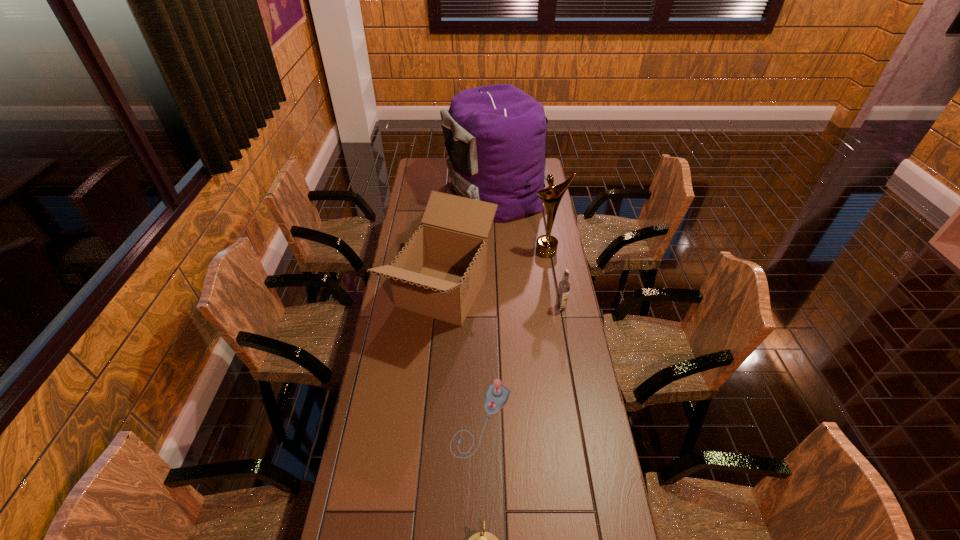
The image size is (960, 540). What are the coordinates of `free space located 0.370m on the front-facing side of the award` in the screenshot? It's located at (559, 323).

Find the location of a particular element. The width and height of the screenshot is (960, 540). vacant space located on the front of the third tallest object is located at coordinates (436, 367).

What are the coordinates of `vacant region located 0.140m on the label of the third shortest object` in the screenshot? It's located at (566, 341).

Where is `free region located on the right of the shortest object`? free region located on the right of the shortest object is located at coordinates (535, 421).

This screenshot has width=960, height=540. What are the coordinates of `object located in the far edge section of the desktop` in the screenshot? It's located at (495, 135).

This screenshot has height=540, width=960. Find the location of `object present at the left edge`. object present at the left edge is located at coordinates (439, 272).

Locate an element on the screen. The width and height of the screenshot is (960, 540). backpack at the right edge is located at coordinates (495, 135).

This screenshot has height=540, width=960. In order to click on award that is at the right edge in this screenshot , I will do `click(546, 246)`.

Locate an element on the screen. Image resolution: width=960 pixels, height=540 pixels. vodka that is at the right edge is located at coordinates (564, 286).

The width and height of the screenshot is (960, 540). Identify the location of object that is at the far right corner. (495, 135).